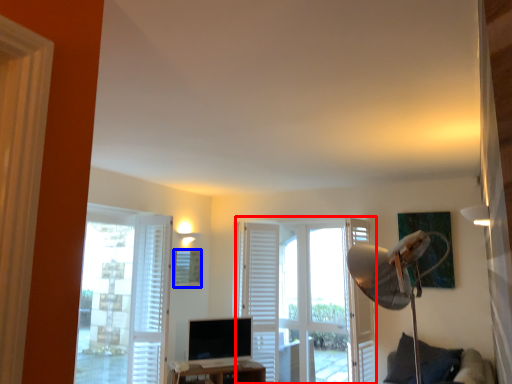
Question: Which object is closer to the camera taking this photo, door (highlighted by a red box) or picture frame (highlighted by a blue box)?

Choices:
 (A) door
 (B) picture frame

Answer: (A)